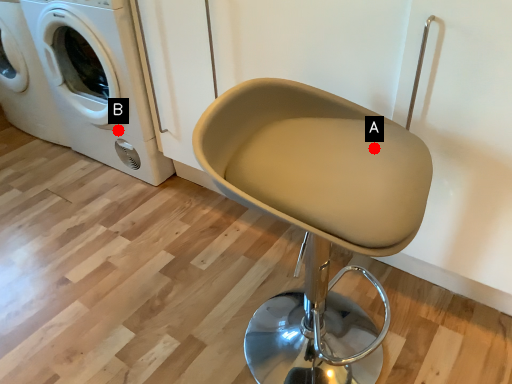
Question: Two points are circled on the image, labeled by A and B beside each circle. Which point is farther to the camera?

Choices:
 (A) A is further
 (B) B is further

Answer: (B)